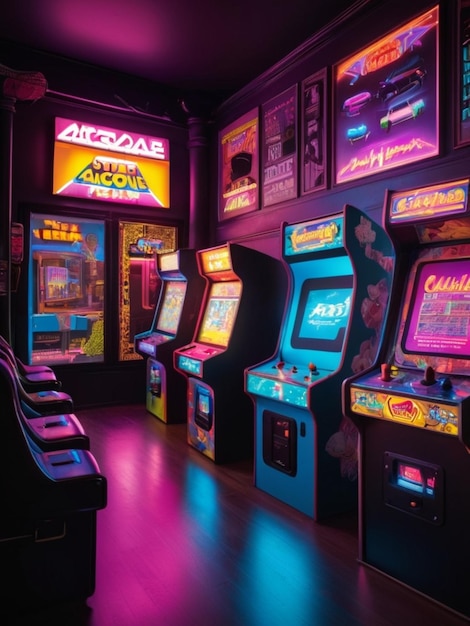
You are a GUI agent. You are given a task and a screenshot of the screen. Output one action in this format:
    pyautogui.click(x=<x>, y=<y>)
    Task: Click on the pink reflection on floor
    This screenshot has height=626, width=470.
    Given the screenshot: What is the action you would take?
    pyautogui.click(x=145, y=552)